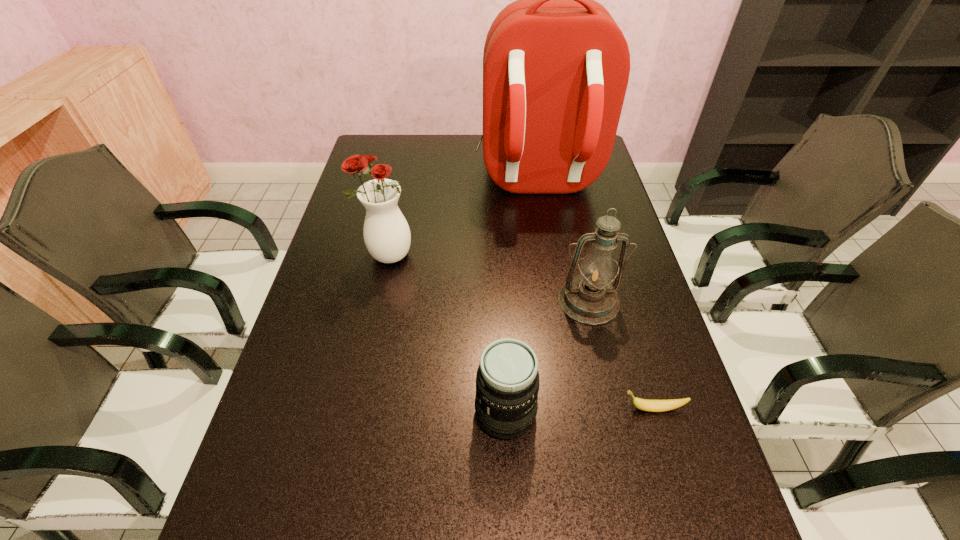
Identify the location of free space located 0.160m on the left of the second shortest object. This screenshot has height=540, width=960. (397, 412).

Locate an element on the screen. This screenshot has width=960, height=540. free space located at the stem of the banana is located at coordinates (462, 409).

Locate an element on the screen. The image size is (960, 540). free location located at the stem of the banana is located at coordinates (587, 409).

Where is `vacant point located 0.270m at the stem of the banana`? vacant point located 0.270m at the stem of the banana is located at coordinates (491, 409).

Identify the location of object situated at the far edge. Image resolution: width=960 pixels, height=540 pixels. (556, 66).

Image resolution: width=960 pixels, height=540 pixels. Identify the location of object that is at the left edge. (386, 232).

Where is `backpack at the right edge`? backpack at the right edge is located at coordinates (556, 66).

Locate an element on the screen. The image size is (960, 540). oil lamp that is at the right edge is located at coordinates (590, 298).

The width and height of the screenshot is (960, 540). I want to click on banana located at the right edge, so click(x=643, y=404).

This screenshot has width=960, height=540. What are the coordinates of `object located in the far right corner section of the desktop` in the screenshot? It's located at (556, 66).